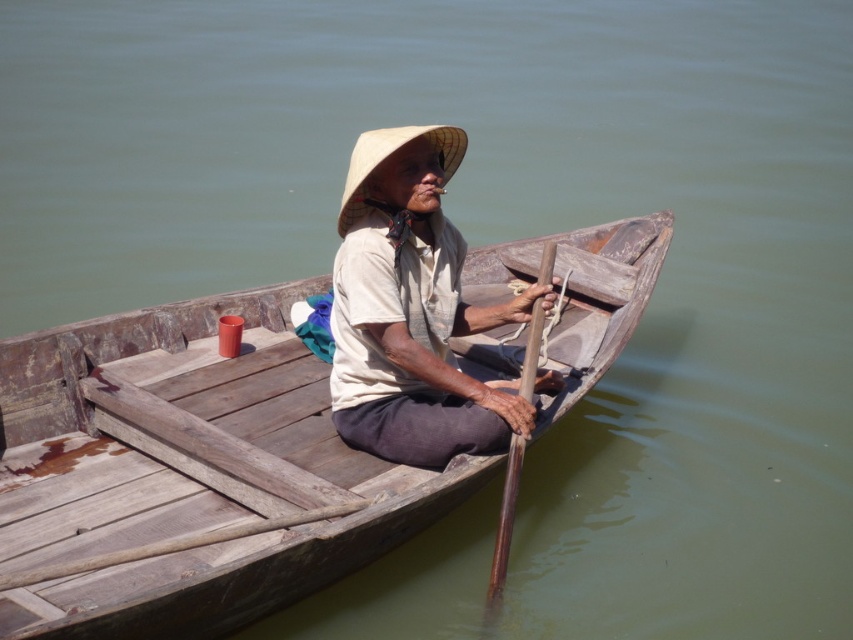
You are standing on the dock and see the elderly person in the boat. What color is the clothing item located at point (412, 310)?

The white cotton shirt at center is located at point (412, 310), so the clothing item there is white.

You are a photographer trying to capture the brown wooden paddle at center in your shot. The camera is positioned at the origin point. What are the coordinates of the paddle?

The coordinates of the brown wooden paddle at center are at point (503, 534).

You are standing on the dock and see the wooden boat at center and the white cotton shirt at center. Which object is closer to you?

The wooden boat at center is closer to the viewer than the white cotton shirt at center.